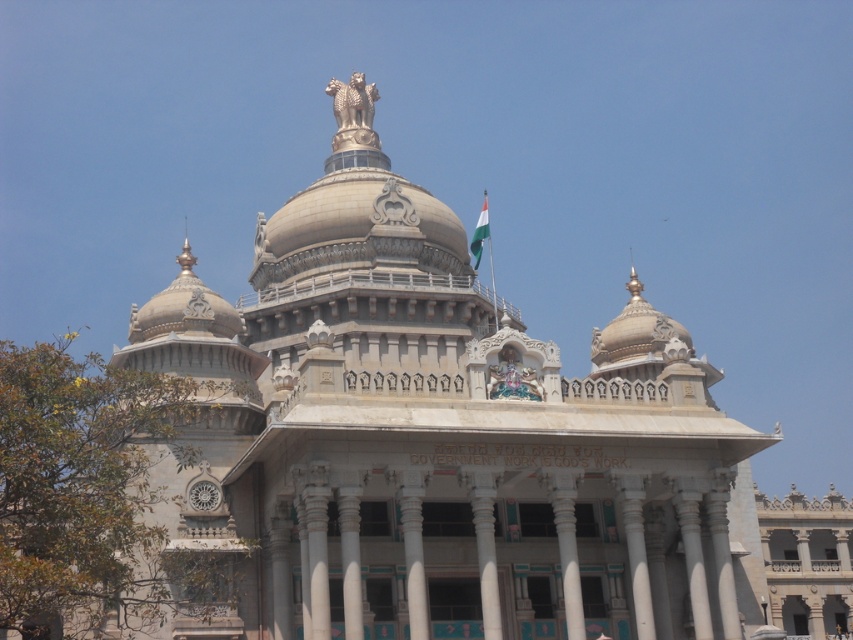
Is polychrome stone statue at center below green fabric flag at upper center?

Yes, polychrome stone statue at center is below green fabric flag at upper center.

Which of these two, polychrome stone statue at center or green fabric flag at upper center, stands taller?

Standing taller between the two is green fabric flag at upper center.

What do you see at coordinates (512, 378) in the screenshot? I see `polychrome stone statue at center` at bounding box center [512, 378].

Identify the location of polychrome stone statue at center. The width and height of the screenshot is (853, 640). (512, 378).